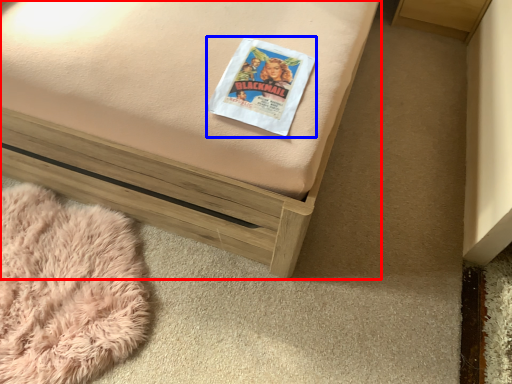
Question: Which object is further to the camera taking this photo, furniture (highlighted by a red box) or paperback book (highlighted by a blue box)?

Choices:
 (A) furniture
 (B) paperback book

Answer: (B)